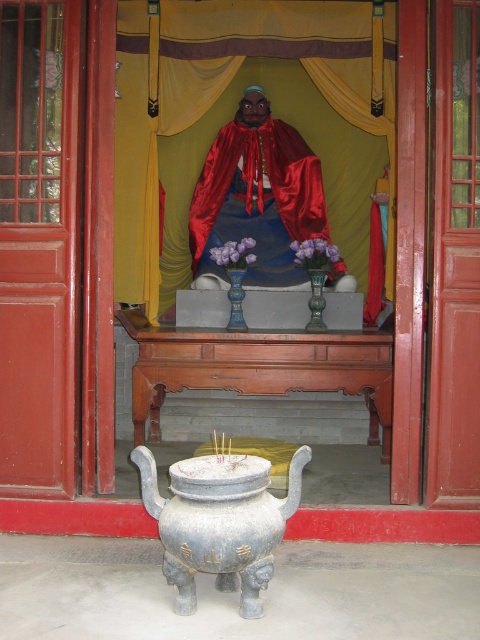
What are the coordinates of `shiny red fabric monk at center` in the screenshot? It's located at (257, 193).

Between point (243, 218) and point (156, 476), which one is positioned behind?

The point (243, 218) is behind.

This screenshot has height=640, width=480. Identify the location of shiny red fabric monk at center. (257, 193).

Which is in front, point (225, 358) or point (251, 586)?

Point (251, 586) is more forward.

Can you confirm if wooden altar at center is bigger than gray stone incense burner at center?

Indeed, wooden altar at center has a larger size compared to gray stone incense burner at center.

Does point (144, 420) lie behind point (192, 506)?

Yes, it is.

This screenshot has width=480, height=640. I want to click on wooden altar at center, so click(257, 368).

Who is shorter, wooden altar at center or shiny red fabric monk at center?

Standing shorter between the two is wooden altar at center.

Does wooden altar at center have a greater height compared to shiny red fabric monk at center?

A: No, wooden altar at center is not taller than shiny red fabric monk at center.

The height and width of the screenshot is (640, 480). Describe the element at coordinates (257, 368) in the screenshot. I see `wooden altar at center` at that location.

The image size is (480, 640). I want to click on wooden altar at center, so click(x=257, y=368).